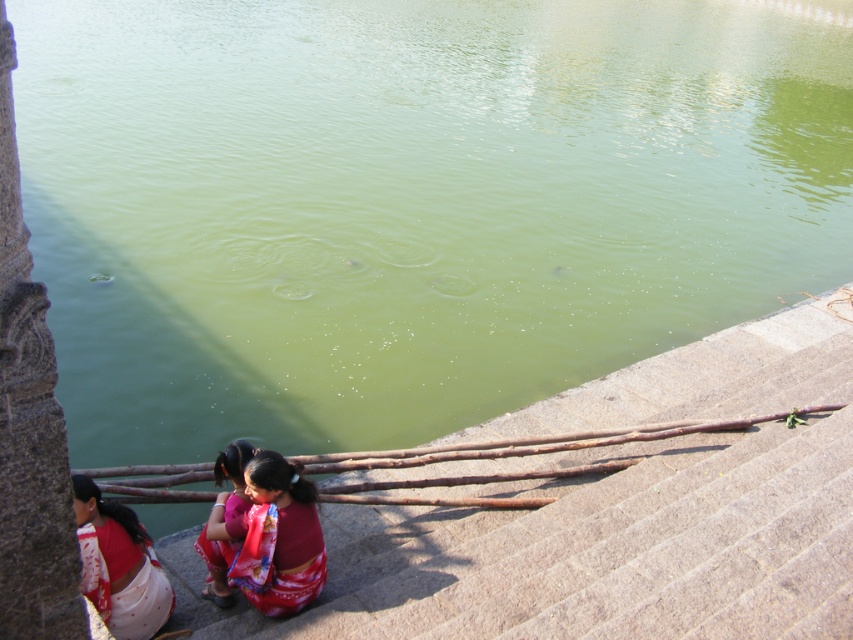
Who is positioned more to the right, red satin sari at lower center or red satin saree at lower center?

red satin sari at lower center is more to the right.

Can you confirm if red satin sari at lower center is wider than red satin saree at lower center?

Yes, red satin sari at lower center is wider than red satin saree at lower center.

This screenshot has width=853, height=640. Identify the location of red satin sari at lower center. (276, 538).

Does point (248, 561) come closer to viewer compared to point (123, 605)?

No.

Which is more to the left, red satin sari at lower center or white cotton saree at lower left?

From the viewer's perspective, white cotton saree at lower left appears more on the left side.

Is point (288, 545) closer to viewer compared to point (129, 600)?

No, (288, 545) is further to viewer.

Locate an element on the screen. The height and width of the screenshot is (640, 853). red satin sari at lower center is located at coordinates (276, 538).

Is white cotton saree at lower left positioned behind red satin saree at lower center?

No, white cotton saree at lower left is closer to the viewer.

Looking at this image, between white cotton saree at lower left and red satin saree at lower center, which one is positioned higher?

Positioned higher is red satin saree at lower center.

Between point (90, 566) and point (206, 552), which one is positioned in front?

Point (90, 566) is in front.

Identify the location of white cotton saree at lower left. (119, 564).